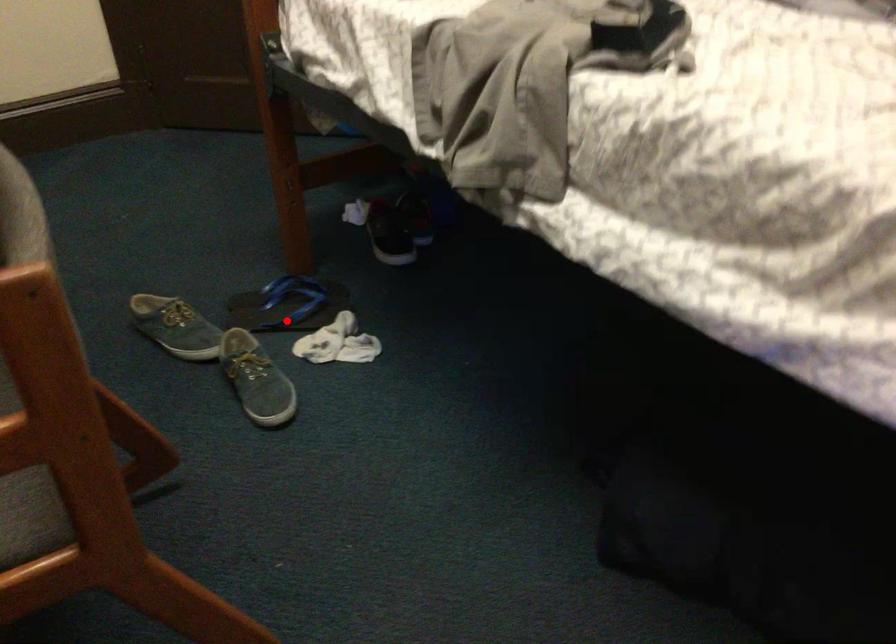
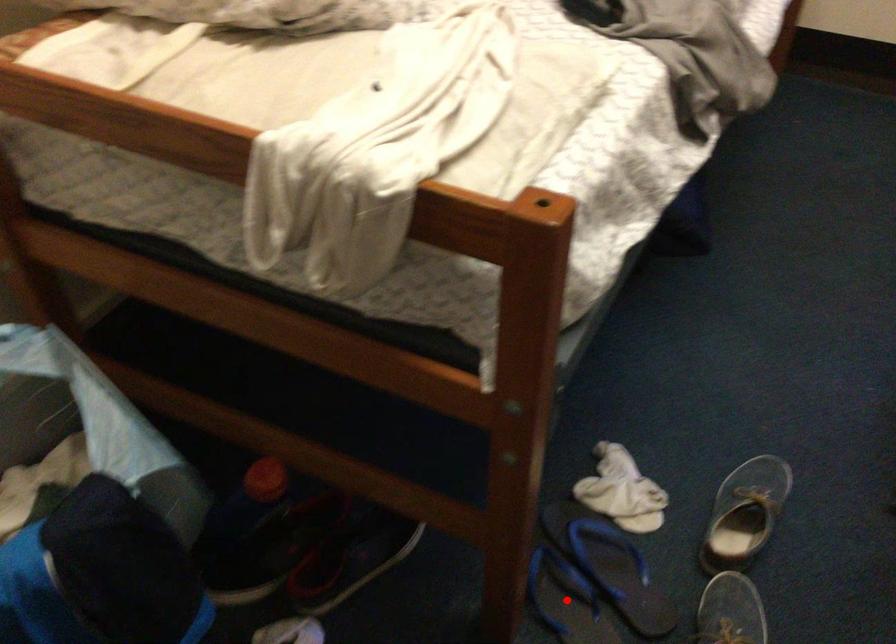
I am providing you with two images of the same scene from different viewpoints. A red point is marked on the first image and another point is marked on the second image. Is the marked point in image1 the same physical position as the marked point in image2?

No